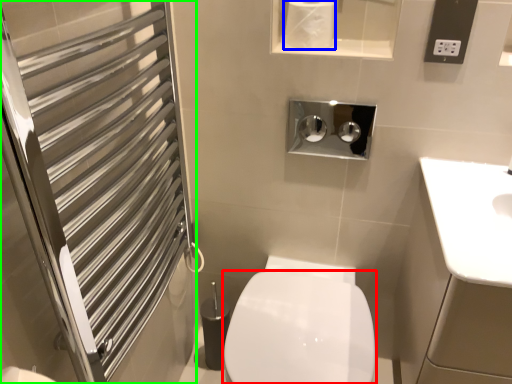
Question: Estimate the real-world distances between objects in this image. Which object is closer to bidet (highlighted by a red box), toilet paper (highlighted by a blue box) or screen door (highlighted by a green box)?

Choices:
 (A) toilet paper
 (B) screen door

Answer: (B)